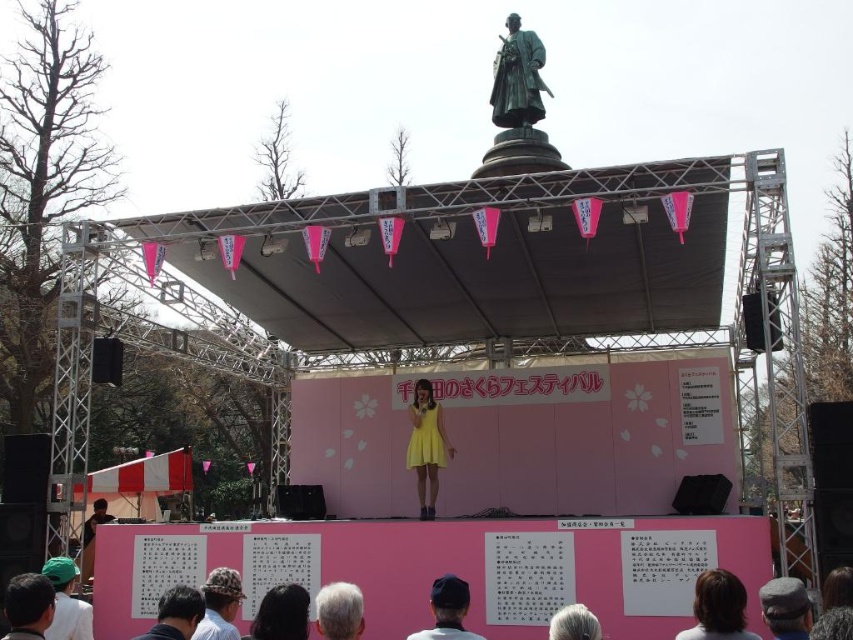
You are a photographer at the event and want to place a small camera bag between the dark blue fabric cap at lower center and the dark gray fabric hat at lower center. Given that the camera bag is 15 cm wide, can you fit it between them without overlapping either item?

The dark blue fabric cap at lower center has a lesser width compared to dark gray fabric hat at lower center. Since the camera bag is 15 cm wide, it depends on the total space between them. However, since the description only mentions the relative widths of the items and not the distance between them, we cannot determine if the bag will fit based on the given information.

You are standing at the event and want to place a new decoration between the two points, point (x=288, y=582) and point (x=50, y=561). Which point should the decoration be closer to if you want it to be in front of the stage backdrop?

The decoration should be closer to point (x=50, y=561) because point (x=288, y=582) is behind point (x=50, y=561), so placing it near the front point (x=50, y=561) keeps it in front of the backdrop.

You are attending an outdoor event and notice two hats on the stage. The green fabric hat at lower left and the gray fabric hat at lower right. Which hat is positioned lower on the stage?

The green fabric hat at lower left is located below the gray fabric hat at lower right, so the green fabric hat at lower left is positioned lower on the stage.